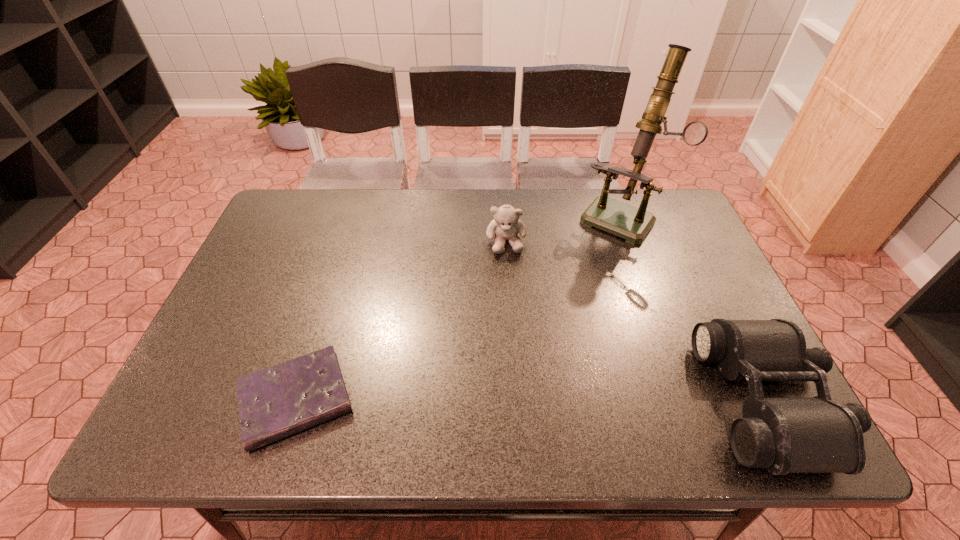
Locate an element on the screen. empty space that is in between the binoculars and the shortest object is located at coordinates (533, 400).

Where is `empty space between the tallest object and the second shortest object`? empty space between the tallest object and the second shortest object is located at coordinates (695, 309).

Where is `unoccupied position between the microscope and the diary`? Image resolution: width=960 pixels, height=540 pixels. unoccupied position between the microscope and the diary is located at coordinates (459, 308).

Image resolution: width=960 pixels, height=540 pixels. Identify the location of unoccupied area between the third tallest object and the microscope. (695, 309).

The width and height of the screenshot is (960, 540). In order to click on vacant space that is in between the diary and the third tallest object in this screenshot , I will do `click(533, 400)`.

You are a GUI agent. You are given a task and a screenshot of the screen. Output one action in this format:
    pyautogui.click(x=<x>, y=<y>)
    Task: Click on the free space between the microscope and the leftmost object
    
    Given the screenshot: What is the action you would take?
    pyautogui.click(x=459, y=308)

What are the coordinates of `free area in between the tallest object and the diary` in the screenshot? It's located at (459, 308).

The image size is (960, 540). Find the location of `free area in between the binoculars and the second object from left to right`. free area in between the binoculars and the second object from left to right is located at coordinates (637, 321).

Find the location of a particular element. This screenshot has width=960, height=540. object identified as the third closest to the leftmost object is located at coordinates (783, 435).

Select which object is the third closest to the microscope. Please provide its 2D coordinates. Your answer should be formatted as a tuple, i.e. [(x, y)], where the tuple contains the x and y coordinates of a point satisfying the conditions above.

[(279, 401)]